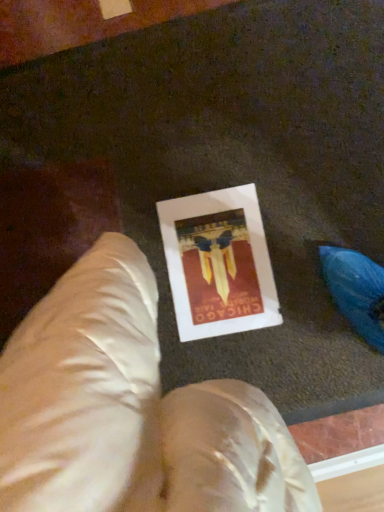
Question: Should I look upward or downward to see white paper at center?

Choices:
 (A) down
 (B) up

Answer: (A)

Question: Is satin beige bean bag chair at center at the left side of white paper at center?

Choices:
 (A) no
 (B) yes

Answer: (B)

Question: Is the surface of satin beige bean bag chair at center in direct contact with white paper at center?

Choices:
 (A) no
 (B) yes

Answer: (A)

Question: Is satin beige bean bag chair at center closer to the viewer compared to white paper at center?

Choices:
 (A) yes
 (B) no

Answer: (A)

Question: Is satin beige bean bag chair at center far from white paper at center?

Choices:
 (A) no
 (B) yes

Answer: (A)

Question: Can you confirm if satin beige bean bag chair at center is taller than white paper at center?

Choices:
 (A) no
 (B) yes

Answer: (B)

Question: Can you confirm if satin beige bean bag chair at center is wider than white paper at center?

Choices:
 (A) no
 (B) yes

Answer: (A)

Question: Is white paper at center taller than satin beige bean bag chair at center?

Choices:
 (A) no
 (B) yes

Answer: (A)

Question: Could you tell me if white paper at center is turned towards satin beige bean bag chair at center?

Choices:
 (A) yes
 (B) no

Answer: (B)

Question: Is white paper at center positioned beyond the bounds of satin beige bean bag chair at center?

Choices:
 (A) no
 (B) yes

Answer: (B)

Question: Can you confirm if white paper at center is bigger than satin beige bean bag chair at center?

Choices:
 (A) yes
 (B) no

Answer: (B)

Question: From the image's perspective, is white paper at center beneath satin beige bean bag chair at center?

Choices:
 (A) yes
 (B) no

Answer: (B)

Question: Considering the relative sizes of white paper at center and satin beige bean bag chair at center in the image provided, is white paper at center smaller than satin beige bean bag chair at center?

Choices:
 (A) no
 (B) yes

Answer: (B)

Question: Is white paper at center in front of or behind satin beige bean bag chair at center in the image?

Choices:
 (A) front
 (B) behind

Answer: (B)